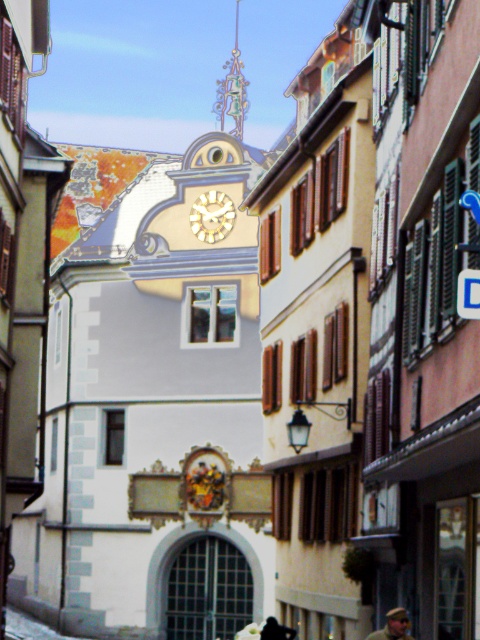
Question: Is camouflage fabric cap at center bigger than dark hair at lower center?

Choices:
 (A) no
 (B) yes

Answer: (A)

Question: Which point is closer to the camera?

Choices:
 (A) (405, 614)
 (B) (463, 292)
 (C) (211, 237)
 (D) (216, 109)

Answer: (B)

Question: Is ornate metal bell tower at upper center to the right of goldmetallicclock at center from the viewer's perspective?

Choices:
 (A) no
 (B) yes

Answer: (A)

Question: Can you confirm if camouflage fabric cap at center is bigger than dark hair at lower center?

Choices:
 (A) no
 (B) yes

Answer: (A)

Question: Which point is closer to the camera?

Choices:
 (A) dark hair at lower center
 (B) blue plastic sign at center
 (C) goldmetallicclock at center
 (D) ornate metal bell tower at upper center

Answer: (B)

Question: Which of the following is the closest to the observer?

Choices:
 (A) camouflage fabric cap at center
 (B) blue plastic sign at center

Answer: (B)